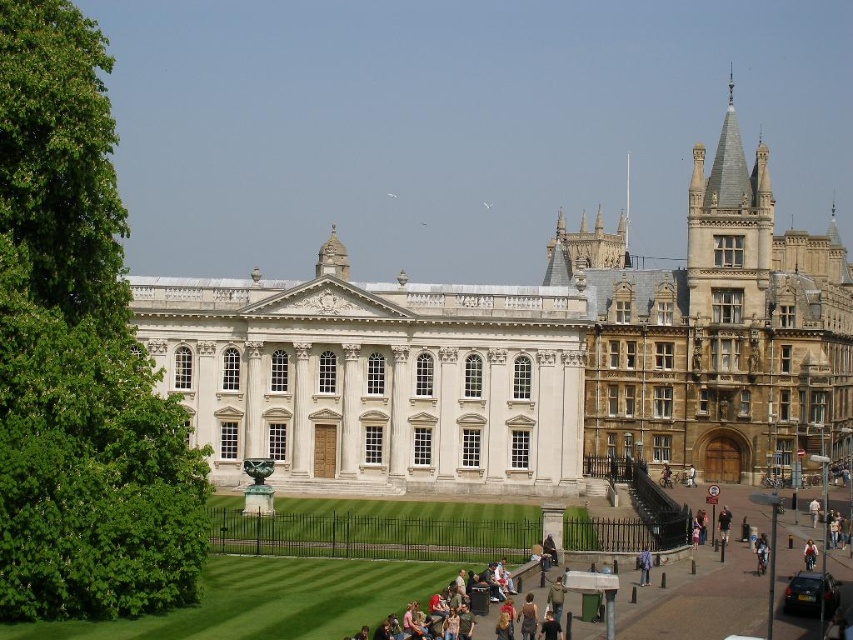
Question: From the image, what is the correct spatial relationship of white stone building at center in relation to denim jacket at lower right?

Choices:
 (A) right
 (B) left

Answer: (B)

Question: Which object is the closest to the light brown leather jacket at center?

Choices:
 (A) brown stone building at right
 (B) purple fabric jacket at lower center
 (C) denim jacket at lower right

Answer: (B)

Question: Observing the image, what is the correct spatial positioning of white polished stone building at center in reference to purple fabric jacket at lower center?

Choices:
 (A) above
 (B) below

Answer: (A)

Question: Which is farther from the denim jacket at lower right?

Choices:
 (A) purple fabric jacket at lower center
 (B) white cotton shirt at center
 (C) white stone building at center

Answer: (C)

Question: Which object appears farthest from the camera in this image?

Choices:
 (A) white stone building at center
 (B) white polished stone building at center

Answer: (A)

Question: Is light brown leather jacket at center bigger than light blue denim jacket at lower right?

Choices:
 (A) yes
 (B) no

Answer: (B)